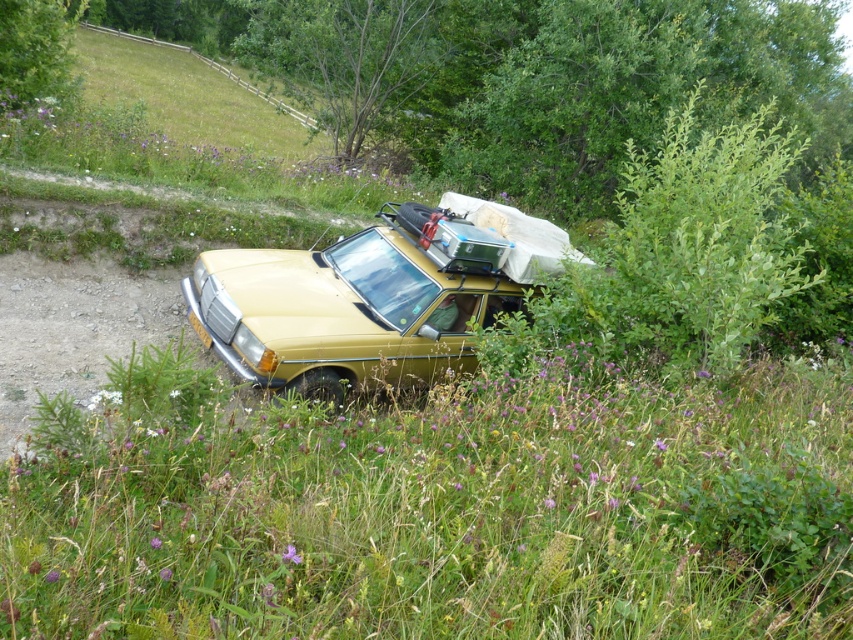
Does green grass at center have a lesser height compared to matte gold car at center?

Indeed, green grass at center has a lesser height compared to matte gold car at center.

What do you see at coordinates (438, 508) in the screenshot? I see `green grass at center` at bounding box center [438, 508].

Which is in front, point (138, 355) or point (320, 268)?

Point (138, 355) is more forward.

Locate an element on the screen. The image size is (853, 640). green grass at center is located at coordinates (438, 508).